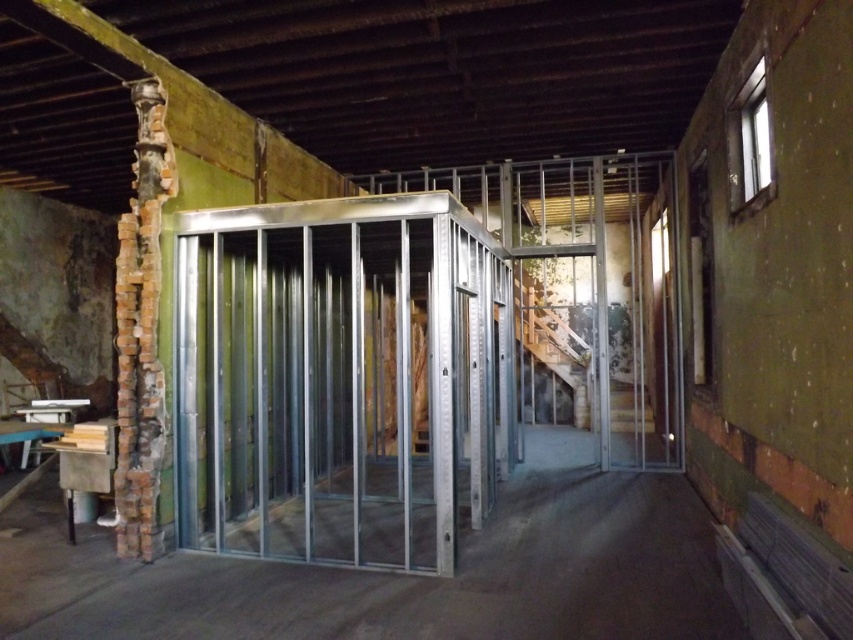
Question: Can you confirm if silver metallic elevator at center is positioned to the left of metal frame at center?

Choices:
 (A) no
 (B) yes

Answer: (B)

Question: Does silver metallic elevator at center appear under metal frame at center?

Choices:
 (A) no
 (B) yes

Answer: (A)

Question: Which point is closer to the camera taking this photo?

Choices:
 (A) (486, 324)
 (B) (564, 609)

Answer: (B)

Question: Can you confirm if silver metallic elevator at center is wider than metal frame at center?

Choices:
 (A) yes
 (B) no

Answer: (B)

Question: Which object appears farthest from the camera in this image?

Choices:
 (A) metal frame at center
 (B) silver metallic elevator at center

Answer: (B)